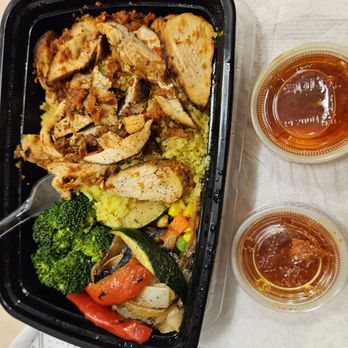
Find the location of a particular element. This screenshot has height=348, width=348. sauce cups is located at coordinates (305, 114), (290, 256).